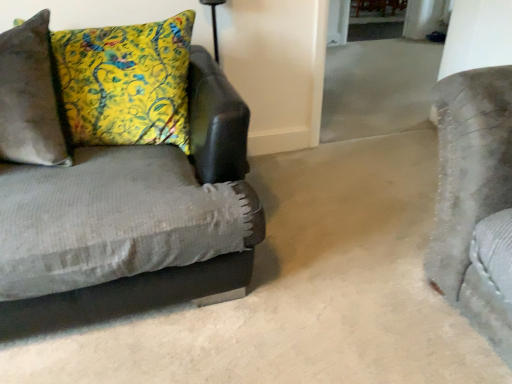
Question: Is velvet gray couch at left inside or outside of yellow floral pillow at left?

Choices:
 (A) inside
 (B) outside

Answer: (B)

Question: Is velvet gray couch at left in front of or behind yellow floral pillow at left in the image?

Choices:
 (A) behind
 (B) front

Answer: (B)

Question: From the image's perspective, relative to yellow floral pillow at left, is velvet gray couch at left above or below?

Choices:
 (A) below
 (B) above

Answer: (A)

Question: From a real-world perspective, relative to velvet gray couch at left, is yellow floral pillow at left vertically above or below?

Choices:
 (A) below
 (B) above

Answer: (B)

Question: Considering the positions of yellow floral pillow at left and velvet gray couch at left in the image, is yellow floral pillow at left bigger or smaller than velvet gray couch at left?

Choices:
 (A) big
 (B) small

Answer: (B)

Question: Considering the positions of point (67, 79) and point (228, 125), is point (67, 79) closer or farther from the camera than point (228, 125)?

Choices:
 (A) farther
 (B) closer

Answer: (A)

Question: In the image, is yellow floral pillow at left positioned in front of or behind velvet gray couch at left?

Choices:
 (A) behind
 (B) front

Answer: (A)